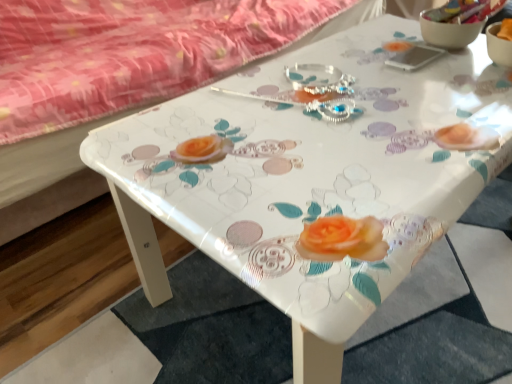
Find the location of a particular element. This screenshot has width=512, height=384. vacant region to the left of white glossy bowl at upper right is located at coordinates (372, 43).